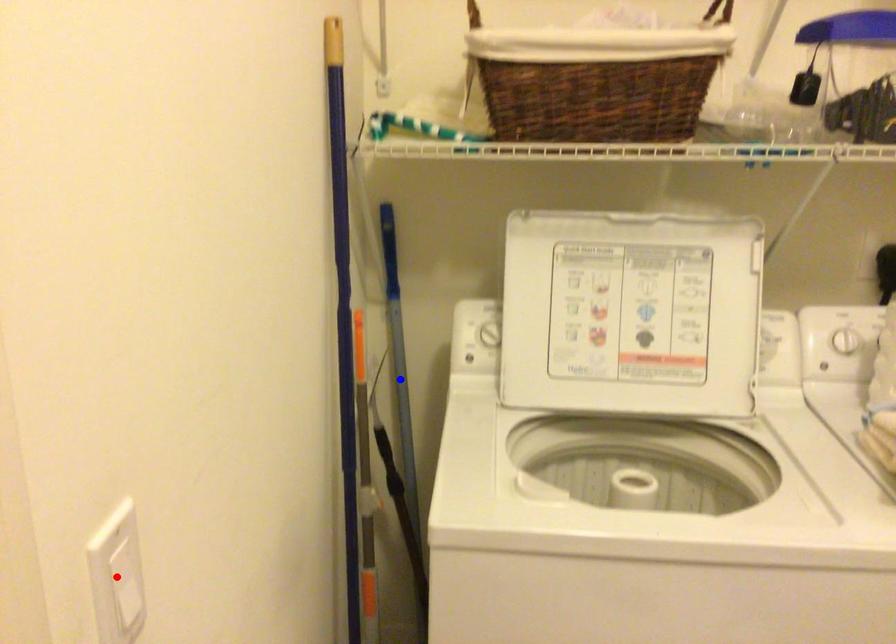
Question: Which of the two points in the image is closer to the camera?

Choices:
 (A) Blue point is closer.
 (B) Red point is closer.

Answer: (B)